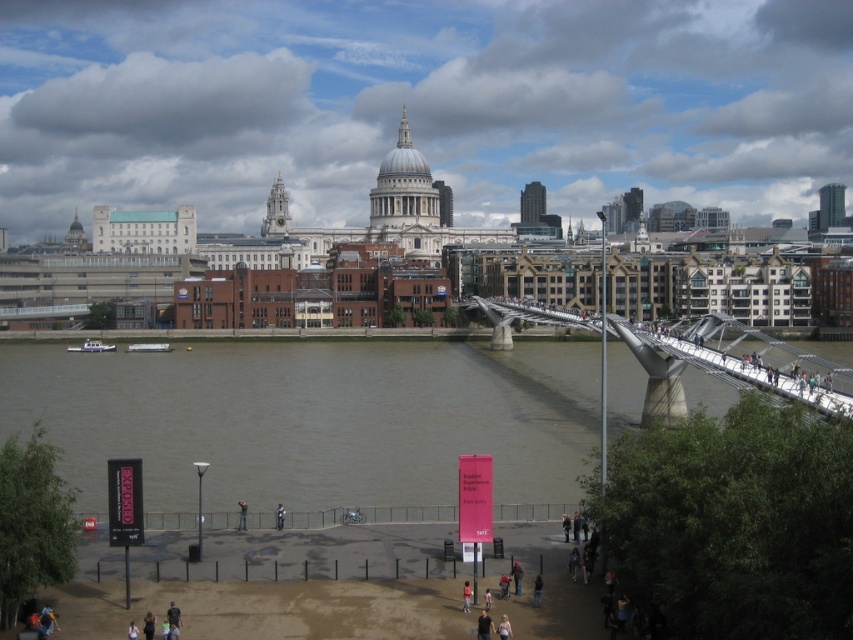
Question: Can you confirm if brown water at lower center is thinner than metallic gray bridge at center right?

Choices:
 (A) no
 (B) yes

Answer: (A)

Question: Does brown water at lower center have a lesser width compared to metallic gray bridge at center right?

Choices:
 (A) yes
 (B) no

Answer: (B)

Question: Can you confirm if brown water at lower center is smaller than metallic gray bridge at center right?

Choices:
 (A) no
 (B) yes

Answer: (A)

Question: Among these points, which one is farthest from the camera?

Choices:
 (A) (558, 445)
 (B) (648, 419)

Answer: (B)

Question: Among these points, which one is nearest to the camera?

Choices:
 (A) (395, 452)
 (B) (762, 339)

Answer: (A)